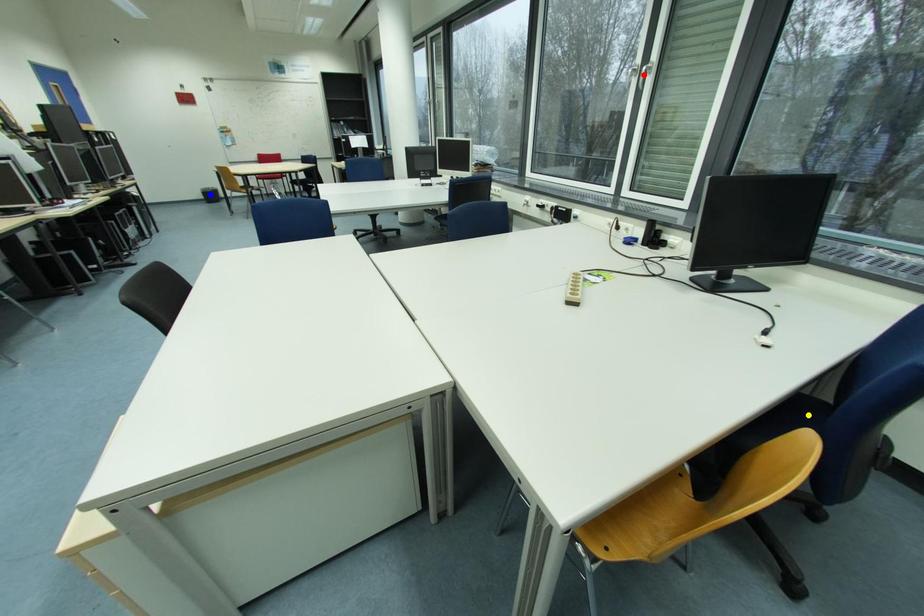
Order these from nearest to farthest:
red point
yellow point
blue point

yellow point, red point, blue point